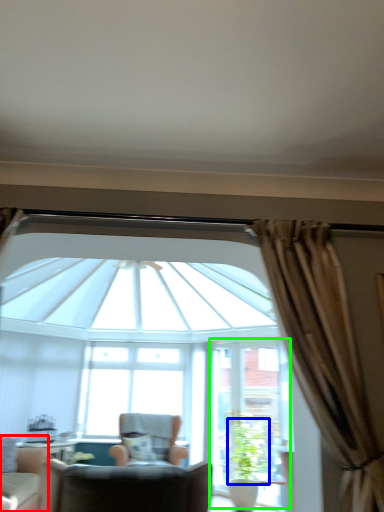
Question: Based on their relative distances, which object is nearer to chair (highlighted by a red box)? Choose from plant (highlighted by a blue box) and screen door (highlighted by a green box).

Choices:
 (A) plant
 (B) screen door

Answer: (B)